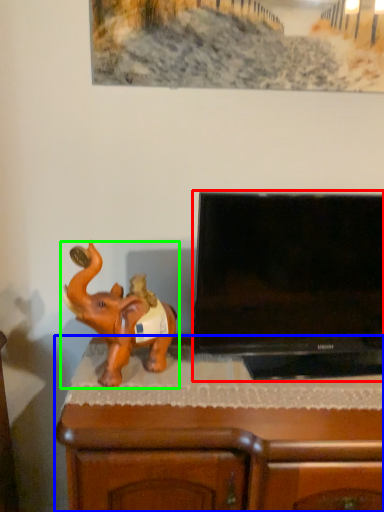
Question: Which object is the closest to the television (highlighted by a red box)? Choose among these: furniture (highlighted by a blue box) or elephant (highlighted by a green box).

Choices:
 (A) furniture
 (B) elephant

Answer: (A)